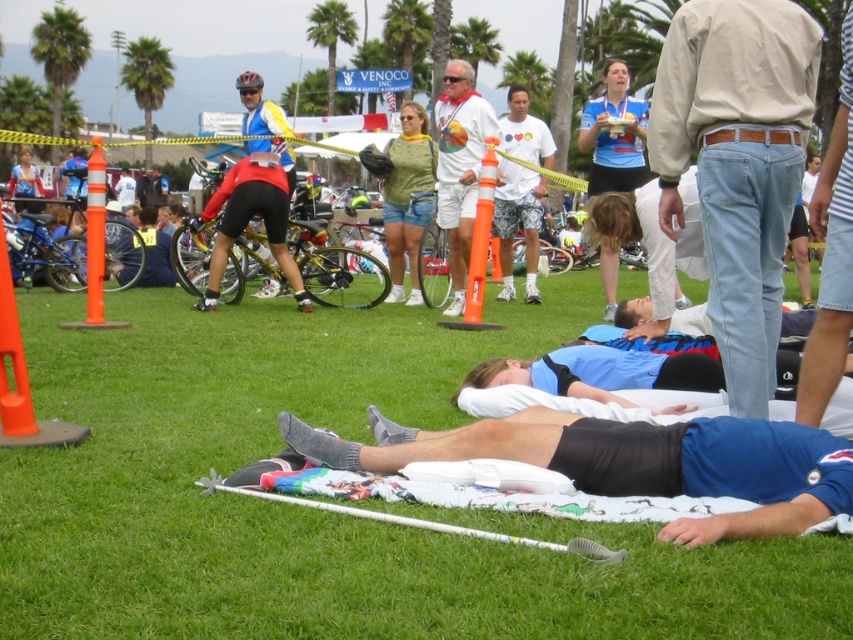
You are planning to set up a small tent for shade in the outdoor scene. The tent requires a clear space of at least 1 meter in width. Given the green grass at lower center and the white matte shirt at center, can you determine if there is enough space between them to place the tent?

The green grass at lower center might be wider than the white matte shirt at center, so there might be sufficient space for the tent if the grass area is indeed wider. However, the exact width isn not specified, so it depends on the actual measurement.